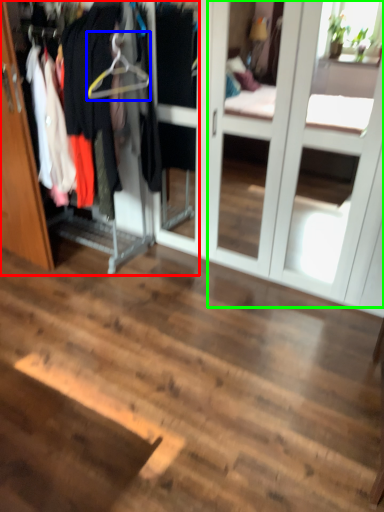
Question: Which is farther away from closet (highlighted by a red box)? hanger (highlighted by a blue box) or screen door (highlighted by a green box)?

Choices:
 (A) hanger
 (B) screen door

Answer: (B)